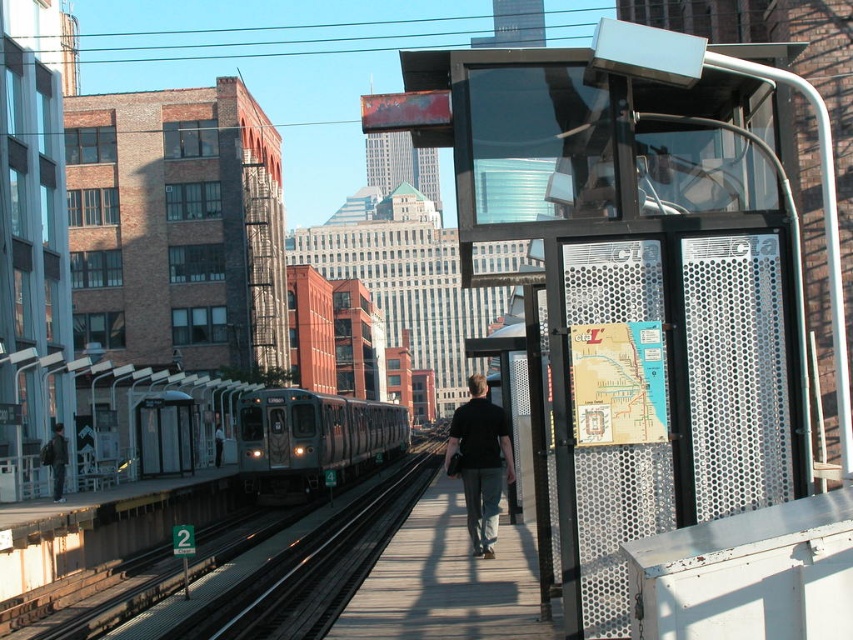
In the scene shown: You are a passenger waiting on the platform and want to board the green metallic train at center. You notice the dark gray pants at center nearby. Which object is wider?

The green metallic train at center is wider than the dark gray pants at center.

You are standing on the platform and see a person wearing a black cotton shirt at center and a dark gray jacket at center. Which one is positioned to the right side?

The black cotton shirt at center is positioned to the right of the dark gray jacket at center.